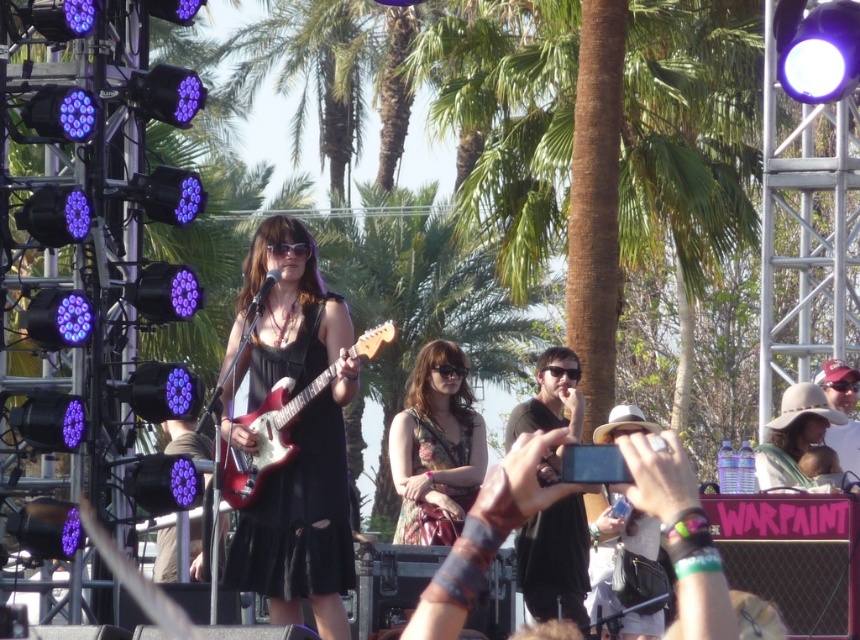
You are a photographer trying to capture the musician in the center. The floral dress at center and the shiny red electric guitar at center are both important elements. Which one should you focus on first if you want to ensure the larger object is in sharp focus?

The floral dress at center has a larger size compared to the shiny red electric guitar at center, so you should focus on the floral dress at center first to ensure it is in sharp focus.

You are a photographer trying to capture the best angle of the concert. You notice two points in the image at coordinates point (321, 365) and point (848, 380). Which point is nearer to your camera lens?

Point (321, 365) is closer to the camera than point (848, 380).